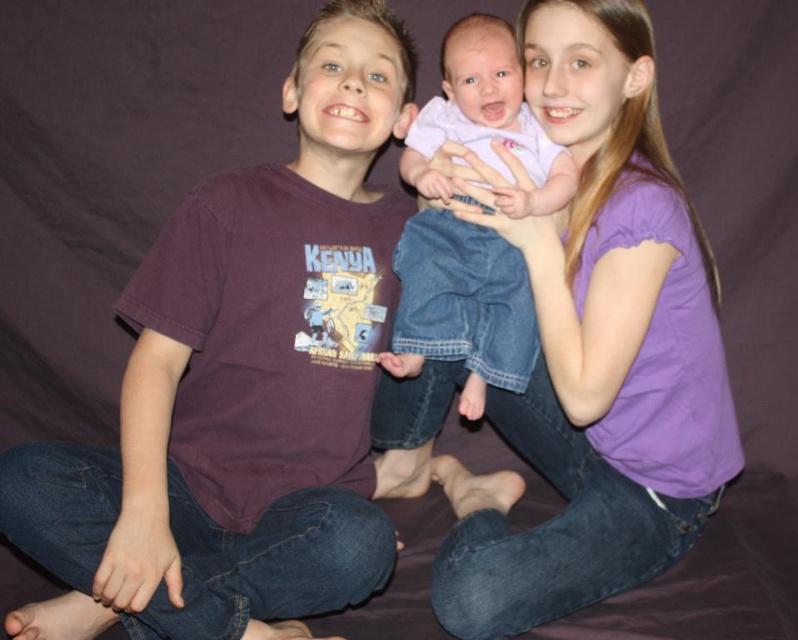
You are a photographer standing at the camera position. You want to take a photo of the three children sitting against the dark purple backdrop. The focus point of your camera is set to point (701,310). Will this point be in focus for the children?

The distance between point (701,310) and the camera is 1.54 meters. Since all the children are sitting closely together against the backdrop, this distance should be within the camera focus range for the children.